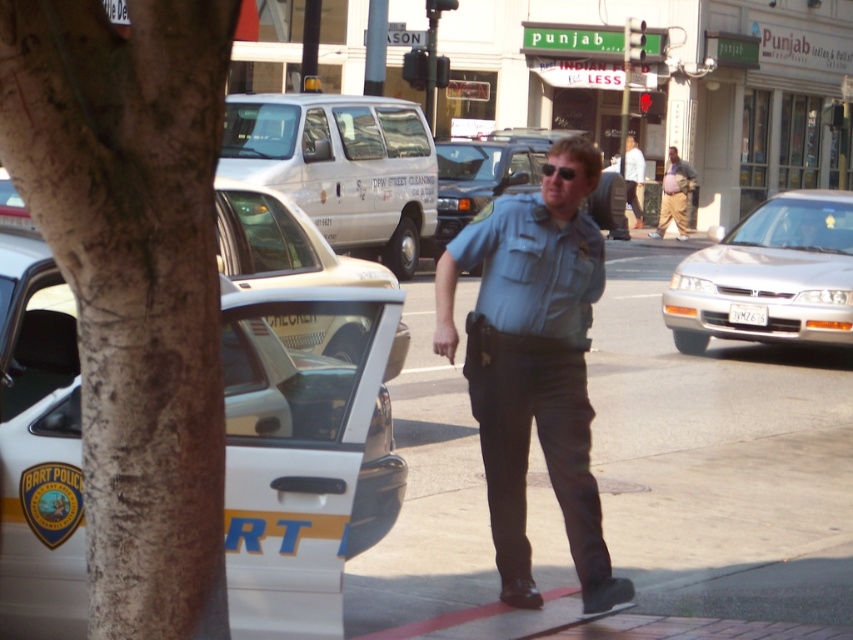
You are a pedestrian standing on the sidewalk. You see a metallic silver taxi at center and a white shirt at center. Which object is taller?

The white shirt at center is taller than the metallic silver taxi at center.

You are a pedestrian standing on the sidewalk and want to cross the street. There is a metallic silver taxi at center and a white shirt at center in your view. Which object is wider from your perspective?

The metallic silver taxi at center is wider than the white shirt at center, so the taxi is wider from your perspective.